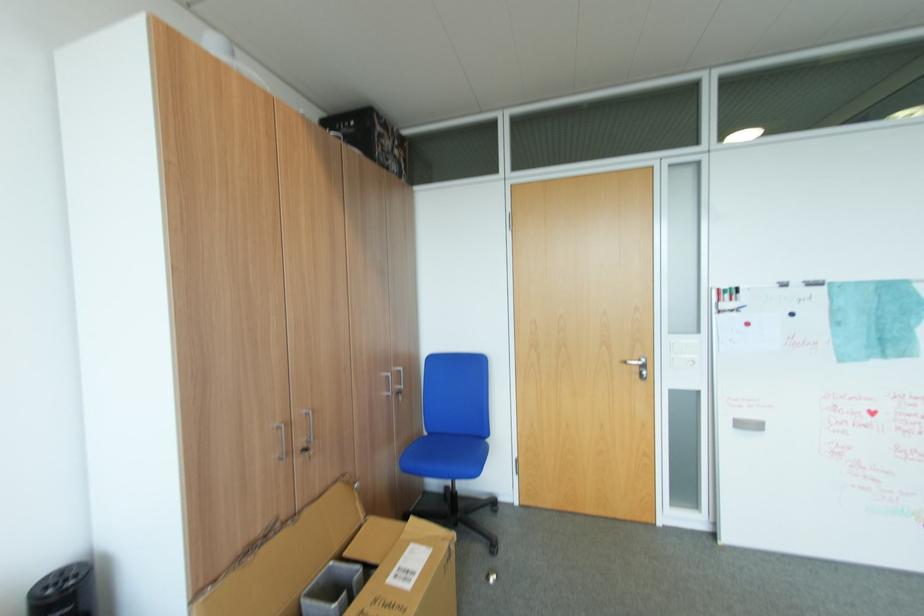
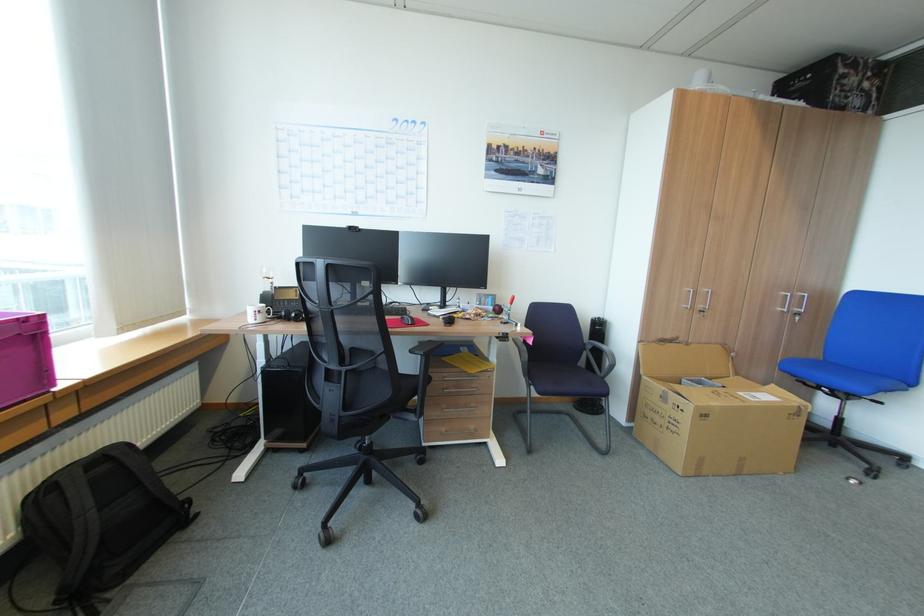
Find the pixel in the second image that matches [408,519] in the first image.

(771, 384)